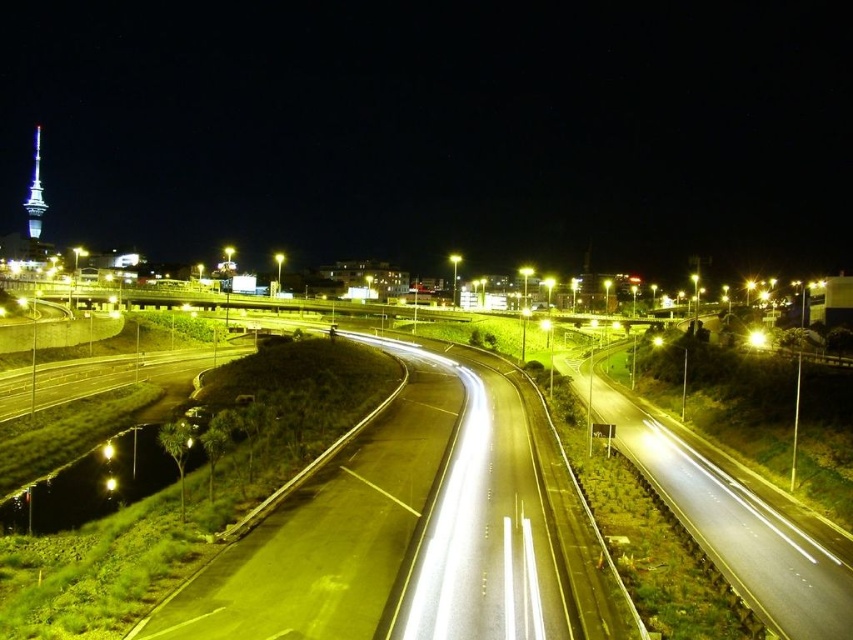
Is black asphalt highway at center below yellow metallic light at center?

Yes, black asphalt highway at center is below yellow metallic light at center.

Does black asphalt highway at center have a larger size compared to yellow metallic light at center?

Yes, black asphalt highway at center is bigger than yellow metallic light at center.

Locate an element on the screen. This screenshot has height=640, width=853. black asphalt highway at center is located at coordinates (728, 518).

Is yellow asphalt highway at center positioned before yellow metallic streetlight at right?

Yes, yellow asphalt highway at center is closer to the viewer.

Looking at this image, measure the distance between point (514, 604) and camera.

Point (514, 604) is 36.83 meters from camera.

Between point (415, 445) and point (752, 339), which one is positioned behind?

The point (752, 339) is behind.

Where is `yellow asphalt highway at center`? Image resolution: width=853 pixels, height=640 pixels. yellow asphalt highway at center is located at coordinates [422, 532].

Who is shorter, black asphalt highway at center or shiny blue tower at upper left?

black asphalt highway at center is shorter.

Image resolution: width=853 pixels, height=640 pixels. I want to click on black asphalt highway at center, so click(728, 518).

Locate an element on the screen. black asphalt highway at center is located at coordinates (728, 518).